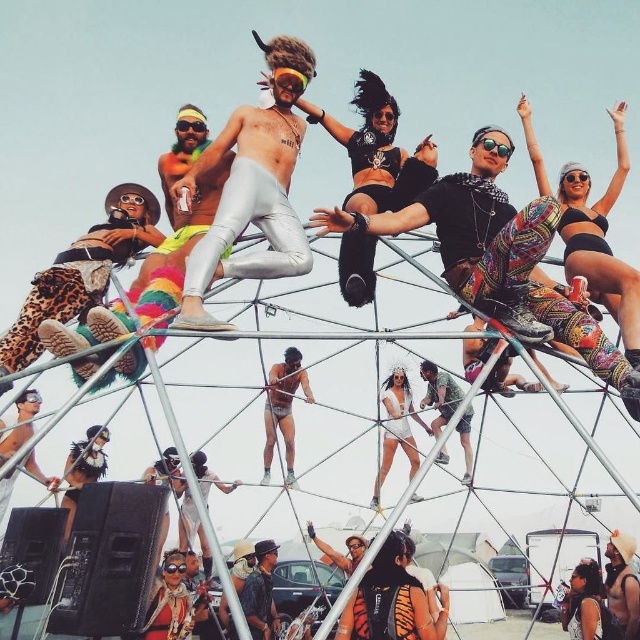
You are a photographer at the festival and want to capture a photo of both the white matte dress at center and the camouflage fabric shorts at center. Which of the two clothing items will appear bigger in the photo?

The white matte dress at center is larger in size than the camouflage fabric shorts at center, so it will appear bigger in the photo.

You are a photographer at the festival trying to capture the metallic silver shorts at center and the camouflage fabric shorts at center. Which of these two shorts is visible on top of the other?

The metallic silver shorts at center is positioned over camouflage fabric shorts at center, so the metallic silver shorts at center is visible on top of the camouflage fabric shorts at center.

You are a photographer at the festival trying to capture the crowd on the dome. You notice the metallic silver shorts at center and the white matte dress at center. Which one is closer to you?

The metallic silver shorts at center is closer to you because the white matte dress at center is behind it.